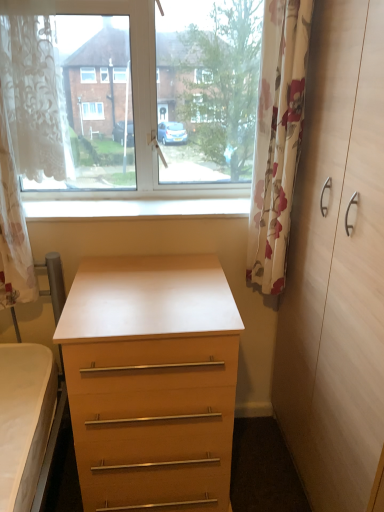
Question: Would you say light wood dresser at right is outside matte wood chest of drawers at center?

Choices:
 (A) no
 (B) yes

Answer: (B)

Question: Is light wood dresser at right at the right side of matte wood chest of drawers at center?

Choices:
 (A) yes
 (B) no

Answer: (A)

Question: From the image's perspective, is light wood dresser at right located beneath matte wood chest of drawers at center?

Choices:
 (A) yes
 (B) no

Answer: (B)

Question: Is matte wood chest of drawers at center inside light wood dresser at right?

Choices:
 (A) no
 (B) yes

Answer: (A)

Question: Considering the relative sizes of light wood dresser at right and matte wood chest of drawers at center in the image provided, is light wood dresser at right smaller than matte wood chest of drawers at center?

Choices:
 (A) yes
 (B) no

Answer: (B)

Question: Is light wood dresser at right to the left of matte wood chest of drawers at center from the viewer's perspective?

Choices:
 (A) no
 (B) yes

Answer: (A)

Question: Is transparent glass window at upper center positioned before matte wood chest of drawers at center?

Choices:
 (A) yes
 (B) no

Answer: (B)

Question: Can matte wood chest of drawers at center be found inside transparent glass window at upper center?

Choices:
 (A) yes
 (B) no

Answer: (B)

Question: From a real-world perspective, is transparent glass window at upper center located higher than matte wood chest of drawers at center?

Choices:
 (A) no
 (B) yes

Answer: (B)

Question: Is transparent glass window at upper center with matte wood chest of drawers at center?

Choices:
 (A) no
 (B) yes

Answer: (A)

Question: Considering the relative sizes of transparent glass window at upper center and matte wood chest of drawers at center in the image provided, is transparent glass window at upper center wider than matte wood chest of drawers at center?

Choices:
 (A) no
 (B) yes

Answer: (A)

Question: Considering the relative sizes of transparent glass window at upper center and matte wood chest of drawers at center in the image provided, is transparent glass window at upper center taller than matte wood chest of drawers at center?

Choices:
 (A) no
 (B) yes

Answer: (A)

Question: Does white lace curtain at left, the first curtain positioned from the left, lie behind floral fabric curtain at right, which is the 1th curtain from right to left?

Choices:
 (A) yes
 (B) no

Answer: (B)